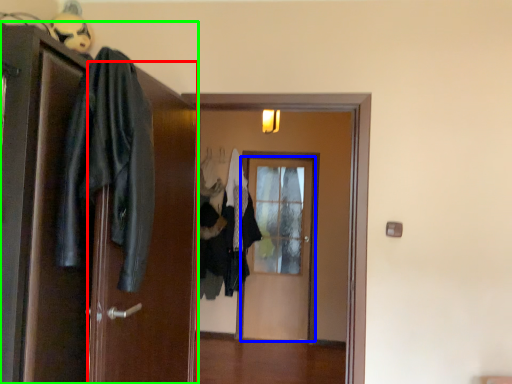
Question: Which object is positioned farthest from screen door (highlighted by a red box)? Select from door (highlighted by a blue box) and door (highlighted by a green box).

Choices:
 (A) door
 (B) door

Answer: (A)